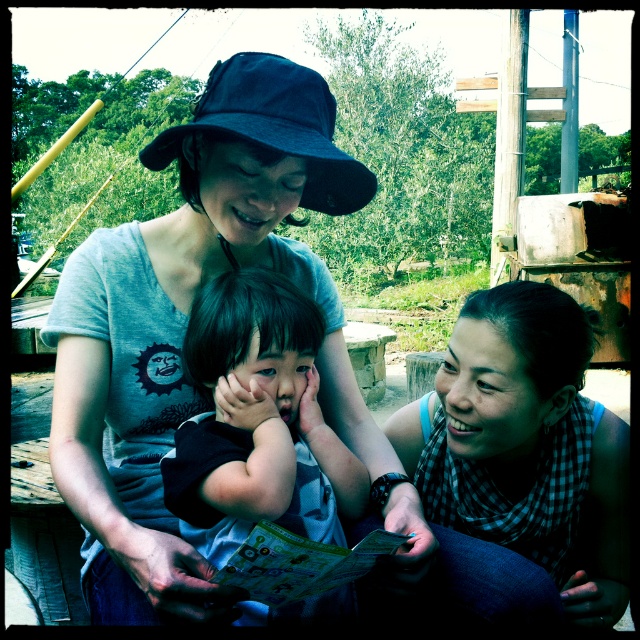
Between checkered fabric at center and black matte baby at center, which one has more height?

checkered fabric at center

Can you confirm if checkered fabric at center is thinner than black matte baby at center?

No, checkered fabric at center is not thinner than black matte baby at center.

The width and height of the screenshot is (640, 640). Describe the element at coordinates (525, 445) in the screenshot. I see `checkered fabric at center` at that location.

You are a GUI agent. You are given a task and a screenshot of the screen. Output one action in this format:
    pyautogui.click(x=<x>, y=<y>)
    Task: Click on the checkered fabric at center
    The height and width of the screenshot is (640, 640).
    Given the screenshot: What is the action you would take?
    click(525, 445)

Can you confirm if matte gray shirt at center is smaller than dark blue fabric baseball hat at upper center?

Incorrect, matte gray shirt at center is not smaller in size than dark blue fabric baseball hat at upper center.

Is point (230, 259) positioned before point (250, 140)?

No, it is not.

What do you see at coordinates (186, 323) in the screenshot?
I see `matte gray shirt at center` at bounding box center [186, 323].

The width and height of the screenshot is (640, 640). In order to click on matte gray shirt at center in this screenshot , I will do `click(186, 323)`.

Which of these two, checkered fabric at center or dark blue fabric baseball hat at upper center, stands shorter?

Standing shorter between the two is dark blue fabric baseball hat at upper center.

Which is in front, point (593, 522) or point (214, 138)?

Point (214, 138) is more forward.

Between point (488, 317) and point (266, 154), which one is positioned behind?

The point (488, 317) is behind.

What are the coordinates of `checkered fabric at center` in the screenshot? It's located at (525, 445).